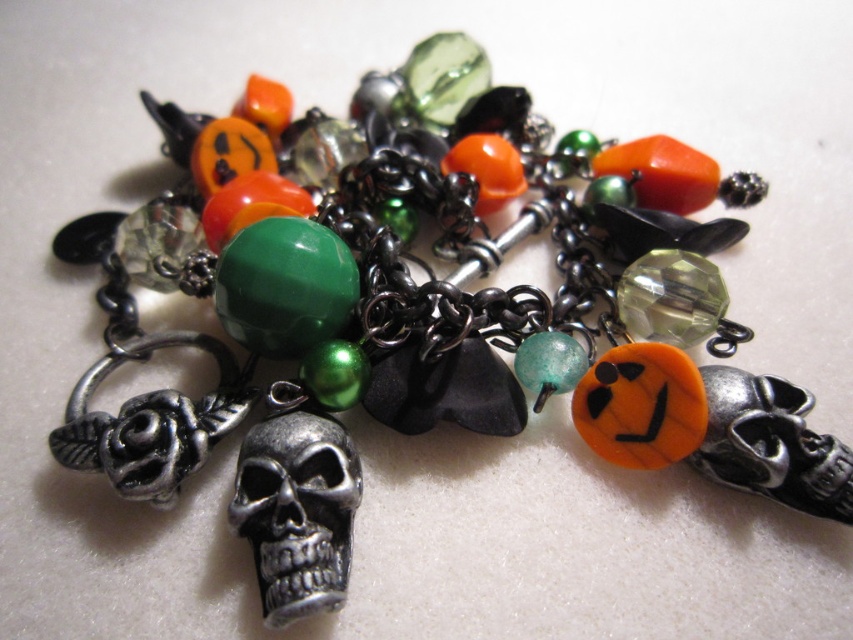
Question: Which of the following is the closest to the observer?

Choices:
 (A) translucent green glass bead at center
 (B) transparent faceted bead at center

Answer: (A)

Question: Is metallic skull at center positioned before translucent green glass bead at center?

Choices:
 (A) no
 (B) yes

Answer: (B)

Question: Which of the following is the farthest from the observer?

Choices:
 (A) translucent green glass bead at center
 (B) metallic skull at center
 (C) transparent faceted bead at center

Answer: (C)

Question: Which is farther from the translucent green glass bead at center?

Choices:
 (A) transparent faceted bead at center
 (B) metallic skull at center

Answer: (B)

Question: From the image, what is the correct spatial relationship of transparent faceted bead at center in relation to translucent green glass bead at center?

Choices:
 (A) below
 (B) above

Answer: (B)

Question: Does metallic skull at center have a greater width compared to translucent green glass bead at center?

Choices:
 (A) no
 (B) yes

Answer: (B)